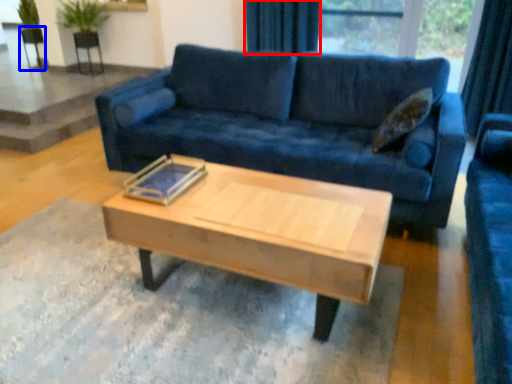
Question: Which point is further to the camera, curtain (highlighted by a red box) or armchair (highlighted by a blue box)?

Choices:
 (A) curtain
 (B) armchair

Answer: (B)